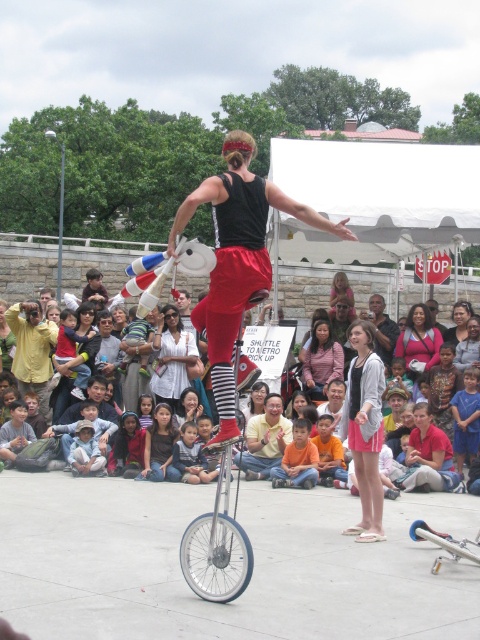
Does white shirt at center appear on the right side of yellow shirt at center?

No, white shirt at center is not to the right of yellow shirt at center.

Between white shirt at center and yellow shirt at center, which one is positioned lower?

yellow shirt at center

Between point (178, 400) and point (276, 412), which one is positioned in front?

Point (276, 412)

Where is `white shirt at center`? white shirt at center is located at coordinates (171, 356).

Is yellow cotton shirt at lower left below pink fabric shirt at center?

No.

Who is more forward, (17, 362) or (307, 364)?

Positioned in front is point (307, 364).

The height and width of the screenshot is (640, 480). What are the coordinates of `yellow cotton shirt at lower left` in the screenshot? It's located at (33, 352).

This screenshot has width=480, height=640. What are the coordinates of `yellow cotton shirt at lower left` in the screenshot? It's located at (33, 352).

Which is more to the right, yellow shirt at center or smooth pink sweater at center?

smooth pink sweater at center is more to the right.

Does yellow shirt at center have a greater height compared to smooth pink sweater at center?

Yes.

What do you see at coordinates (264, 440) in the screenshot? I see `yellow shirt at center` at bounding box center [264, 440].

Where is `yellow shirt at center`? This screenshot has height=640, width=480. yellow shirt at center is located at coordinates (264, 440).